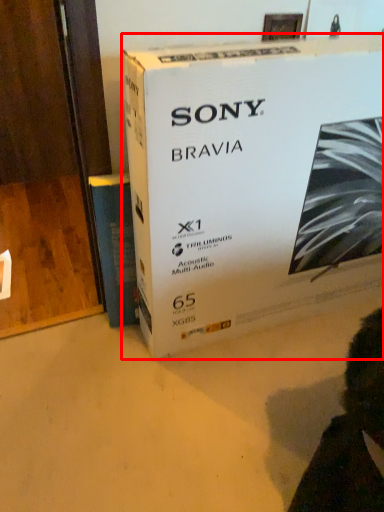
Question: From the image's perspective, considering the relative positions of box (annotated by the red box) and paperback book in the image provided, where is box (annotated by the red box) located with respect to the staircase?

Choices:
 (A) below
 (B) above

Answer: (B)